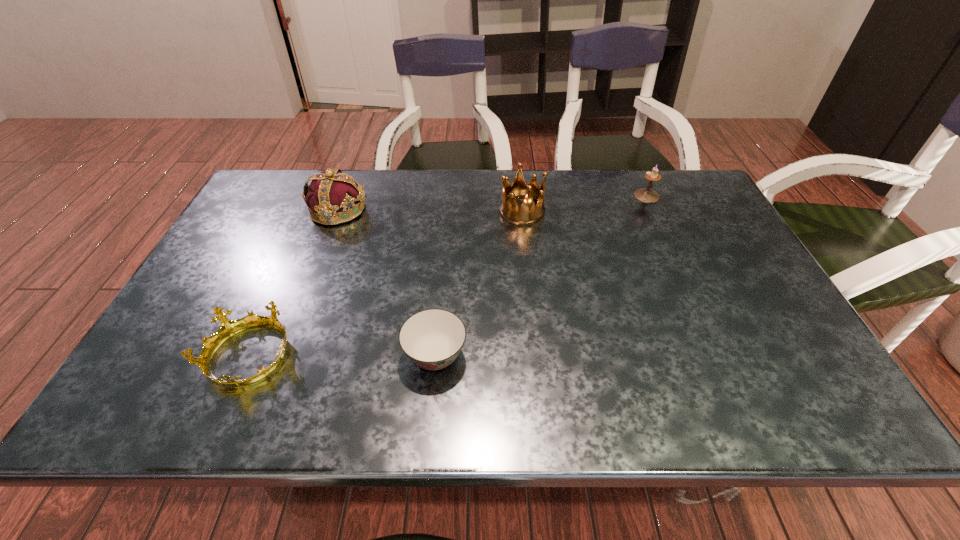
Identify which crown is the second nearest to the rightmost crown. Please provide its 2D coordinates. Your answer should be formatted as a tuple, i.e. [(x, y)], where the tuple contains the x and y coordinates of a point satisfying the conditions above.

[(228, 328)]

Locate an element on the screen. The height and width of the screenshot is (540, 960). the second closest crown to the shortest crown is located at coordinates (529, 213).

Identify the location of vacant space that satisfies the following two spatial constraints: 1. on the back side of the candle holder; 2. on the right side of the rightmost crown. The height and width of the screenshot is (540, 960). (520, 196).

Find the location of a particular element. free space that satisfies the following two spatial constraints: 1. on the back side of the candle holder; 2. on the left side of the fourth object from left to right is located at coordinates (520, 196).